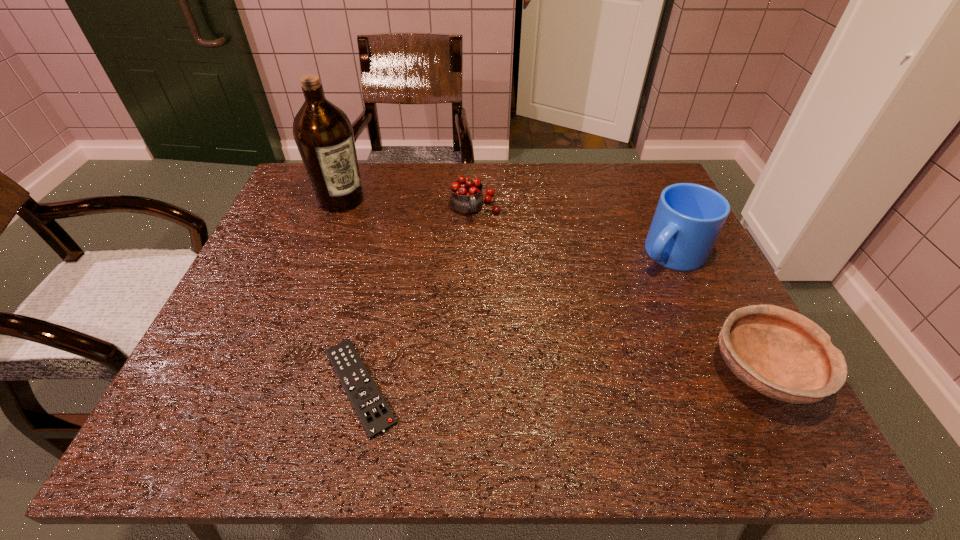
Where is `the shortest object`? The image size is (960, 540). the shortest object is located at coordinates (375, 415).

This screenshot has height=540, width=960. I want to click on remote control, so click(375, 415).

Locate an element on the screen. the second shortest object is located at coordinates (780, 353).

At what (x,y) coordinates should I click in order to perform the action: click on pot filled with cherries. Please return your answer as a coordinate pair (x, y). The image size is (960, 540). Looking at the image, I should click on (466, 198).

Identify the location of the tallest object. (323, 133).

At what (x,y) coordinates should I click in order to perform the action: click on olive oil. Please return your answer as a coordinate pair (x, y). Looking at the image, I should click on (323, 133).

Locate an element on the screen. the third farthest object is located at coordinates (688, 219).

Find the location of a particular element. free location located 0.270m on the back of the second object from left to right is located at coordinates (389, 254).

You are a GUI agent. You are given a task and a screenshot of the screen. Output one action in this format:
    pyautogui.click(x=<x>, y=<y>)
    Task: Click on the free space located 0.260m on the back of the bowl
    
    Given the screenshot: What is the action you would take?
    pyautogui.click(x=698, y=248)

Where is `free spot located 0.390m on the handle side of the pot filled with cherries`? This screenshot has height=540, width=960. free spot located 0.390m on the handle side of the pot filled with cherries is located at coordinates (526, 338).